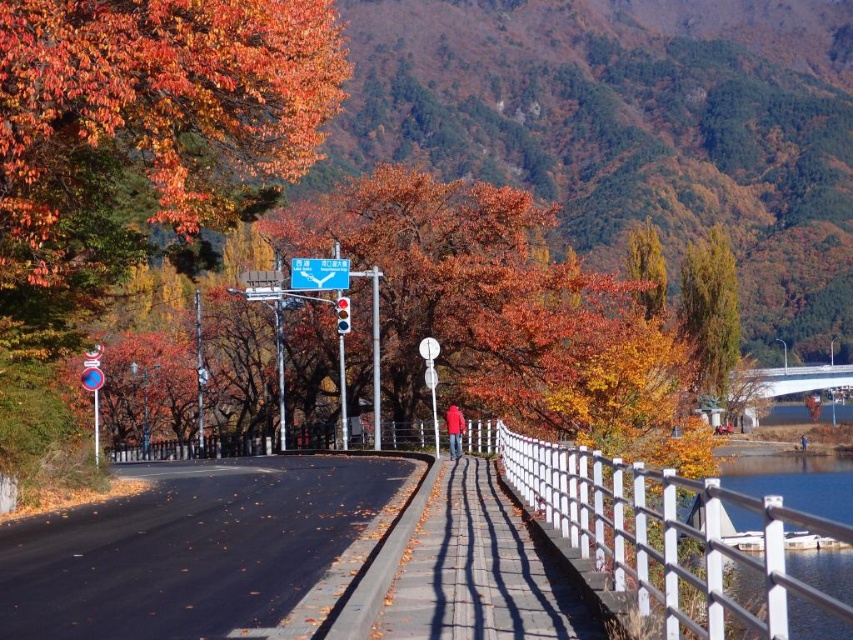
Question: Can you confirm if smooth glass water at right is smaller than blue plastic sign at center?

Choices:
 (A) yes
 (B) no

Answer: (B)

Question: Can you confirm if white concrete bridge at right is wider than blue plastic sign at center?

Choices:
 (A) yes
 (B) no

Answer: (A)

Question: Which point is farther to the camera?

Choices:
 (A) blue plastic sign at center
 (B) white concrete bridge at right
 (C) yellow-green leafy tree at upper right

Answer: (B)

Question: Can you confirm if smooth glass water at right is thinner than blue plastic sign at center?

Choices:
 (A) no
 (B) yes

Answer: (A)

Question: Estimate the real-world distances between objects in this image. Which object is closer to the green leafy tree at upper right?

Choices:
 (A) blue plastic sign at center
 (B) yellow-green leafy tree at upper right
 (C) smooth glass water at right

Answer: (B)

Question: Estimate the real-world distances between objects in this image. Which object is farther from the smooth glass water at right?

Choices:
 (A) white concrete bridge at right
 (B) blue plastic sign at center

Answer: (B)